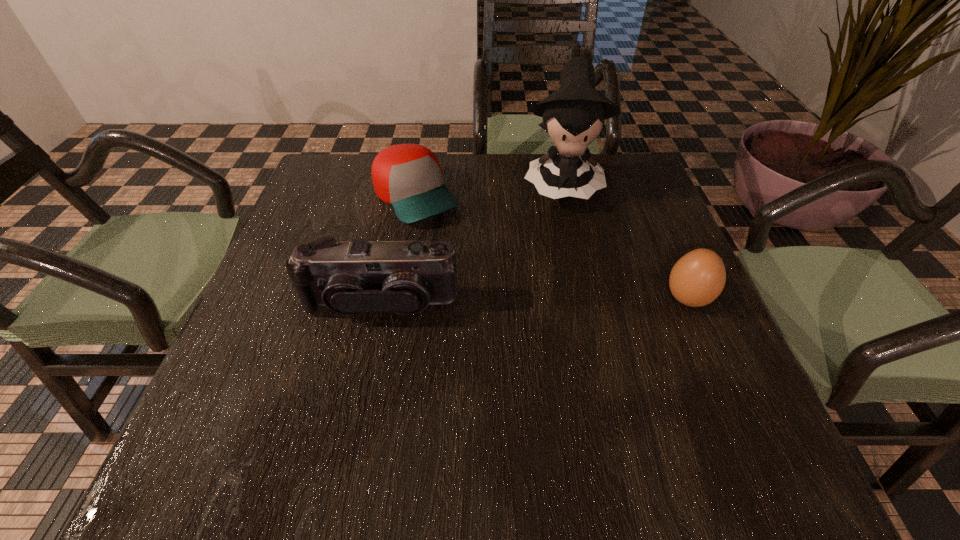
Where is `vacant space at the near edge`? Image resolution: width=960 pixels, height=540 pixels. vacant space at the near edge is located at coordinates (315, 386).

The width and height of the screenshot is (960, 540). What are the coordinates of `free point at the left edge` in the screenshot? It's located at (280, 325).

Where is `vacant space at the right edge of the desktop`? The width and height of the screenshot is (960, 540). vacant space at the right edge of the desktop is located at coordinates (670, 362).

Identify the location of vacant space at the far left corner of the desktop. (324, 153).

Identify the location of vacant space at the far right corner. click(x=637, y=172).

The image size is (960, 540). In order to click on vacant space at the near right corner in this screenshot , I will do `click(692, 400)`.

Where is `vacant space that's between the rightmost object and the camcorder`? vacant space that's between the rightmost object and the camcorder is located at coordinates (534, 301).

The width and height of the screenshot is (960, 540). I want to click on free area in between the camcorder and the doll, so click(x=470, y=242).

Locate an element on the screen. free space that is in between the rightmost object and the tallest object is located at coordinates [x=624, y=240].

Where is `free spot between the camcorder and the boiled egg`? free spot between the camcorder and the boiled egg is located at coordinates [534, 301].